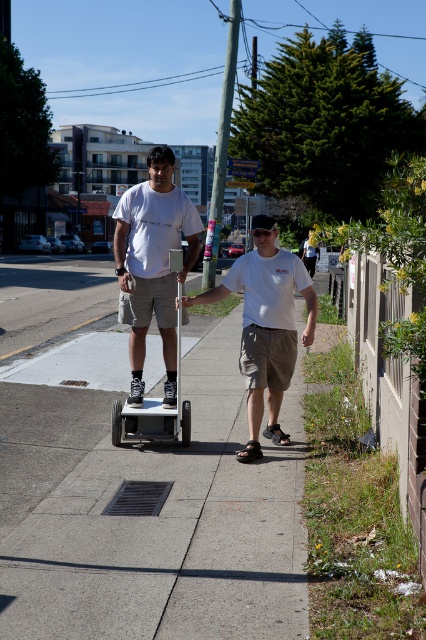
You are a pedestrian trying to cross the street and see the white matte shirt at center and the metallic silver scooter at center. Which one is closer to you?

The white matte shirt at center is closer to you because it is positioned further to the viewer than the metallic silver scooter at center.

You are a photographer trying to capture a portrait of the matte white shirt at center. Where should you position your camera to ensure the subject is centered in the frame?

Position the camera so that the matte white shirt at center is aligned with the center point of the frame, which corresponds to the coordinates provided in the description.

You are standing on the sidewalk and want to take a photo of both the point at coordinates [291,346] and the point at coordinates [115,403]. Which point will appear larger in your photo?

The point at coordinates [291,346] will appear larger in the photo because it is closer to the camera than the point at coordinates [115,403].